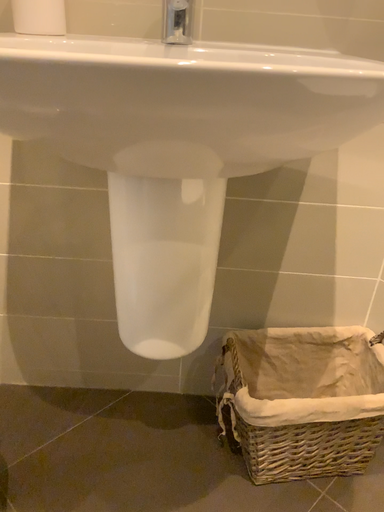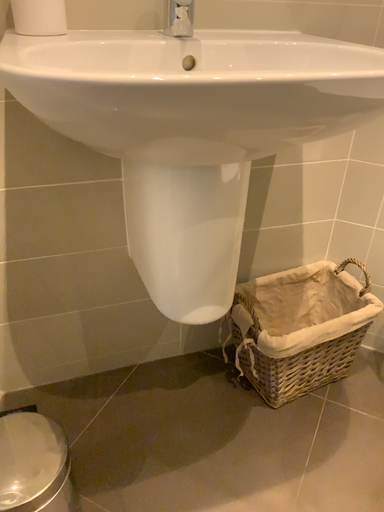
Question: How did the camera likely rotate when shooting the video?

Choices:
 (A) rotated left
 (B) rotated right

Answer: (B)